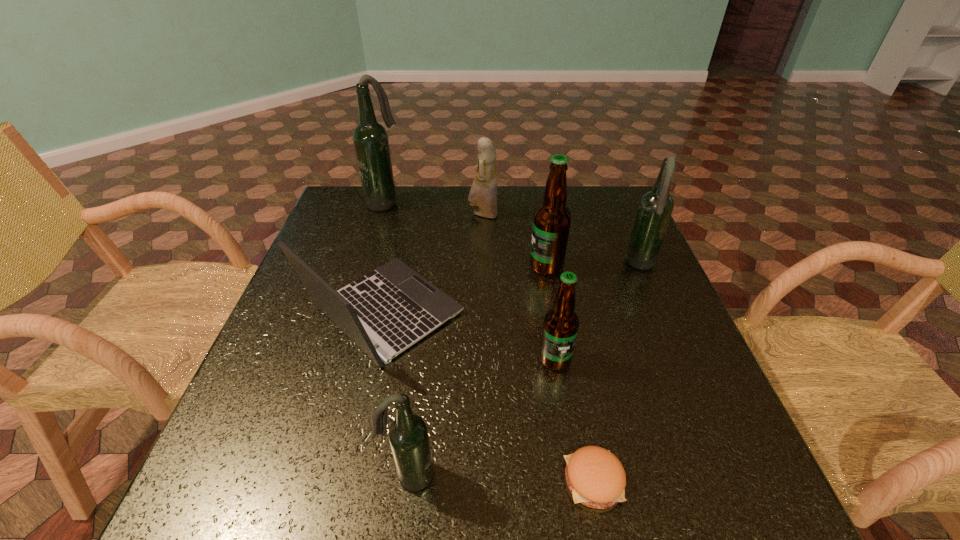
Image resolution: width=960 pixels, height=540 pixels. Find the location of `laptop_computer`. laptop_computer is located at coordinates tap(393, 307).

At what (x,y) coordinates should I click in order to perform the action: click on the shortest object. Please return your answer as a coordinate pair (x, y). The image size is (960, 540). Looking at the image, I should click on (596, 478).

The height and width of the screenshot is (540, 960). I want to click on blank area located 0.150m on the front of the leftmost dark beer bottle, so click(372, 242).

At what (x,y) coordinates should I click in order to perform the action: click on free space located 0.320m on the label of the bigger brown beer bottle. Please return your answer as a coordinate pair (x, y). The height and width of the screenshot is (540, 960). Looking at the image, I should click on (404, 266).

The image size is (960, 540). Find the location of `free space located 0.050m on the label of the bigger brown beer bottle`. free space located 0.050m on the label of the bigger brown beer bottle is located at coordinates (510, 266).

You are a GUI agent. You are given a task and a screenshot of the screen. Output one action in this format:
    pyautogui.click(x=<x>, y=<y>)
    Task: Click on the vacant space located 0.090m on the label of the bigger brown beer bottle
    
    Given the screenshot: What is the action you would take?
    tap(493, 266)

The image size is (960, 540). I want to click on vacant space located 0.310m on the left of the rightmost beer bottle, so click(x=505, y=265).

Identify the location of vacant space situated 0.310m on the front-facing side of the fifth object from right to left. The width and height of the screenshot is (960, 540). (364, 214).

The height and width of the screenshot is (540, 960). I want to click on blank space located on the front-facing side of the fifth object from right to left, so click(397, 214).

Locate an element on the screen. free space located 0.080m on the front-facing side of the fifth object from right to left is located at coordinates (442, 214).